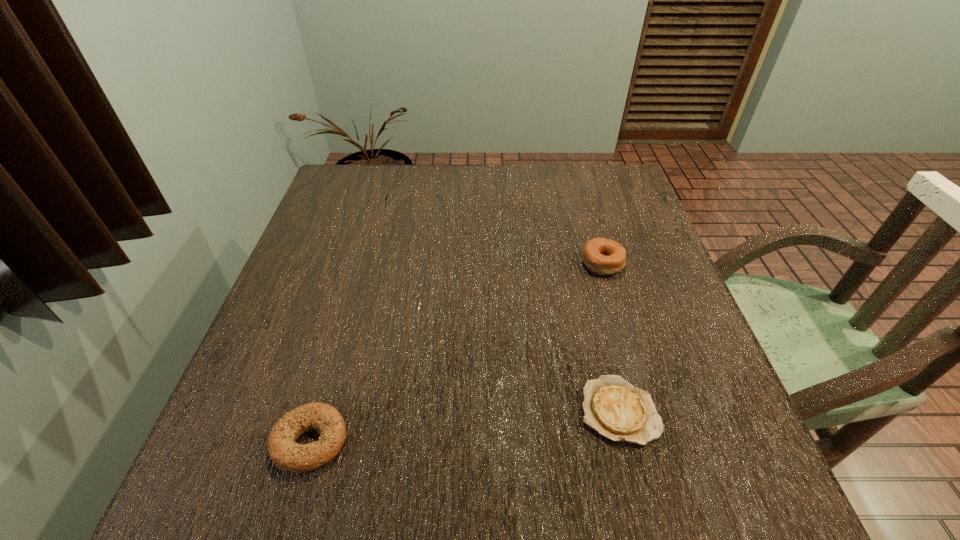
Where is `object situated at the far edge`? Image resolution: width=960 pixels, height=540 pixels. object situated at the far edge is located at coordinates (385, 197).

This screenshot has height=540, width=960. I want to click on object located at the near edge, so pyautogui.click(x=286, y=454).

This screenshot has height=540, width=960. What are the coordinates of `sunglasses situated at the left edge` in the screenshot? It's located at (385, 197).

Locate an element on the screen. bagel at the left edge is located at coordinates (286, 454).

Identify the location of bagel located in the right edge section of the desktop. (601, 256).

Where is `quiche that is positioned at the right edge`? The width and height of the screenshot is (960, 540). quiche that is positioned at the right edge is located at coordinates (618, 411).

You are a GUI agent. You are given a task and a screenshot of the screen. Output one action in this format:
    pyautogui.click(x=<x>, y=<y>)
    Task: Click on the object that is at the far left corner
    
    Given the screenshot: What is the action you would take?
    pyautogui.click(x=385, y=197)

At what (x,y) coordinates should I click in order to perform the action: click on object that is at the near left corner. Please return your answer as a coordinate pair (x, y). The image size is (960, 540). Looking at the image, I should click on (286, 454).

This screenshot has width=960, height=540. In order to click on free spot at the far edge of the desktop in this screenshot , I will do `click(439, 170)`.

Find the location of a particular element. This screenshot has width=960, height=540. vacant position at the near edge of the desktop is located at coordinates (363, 496).